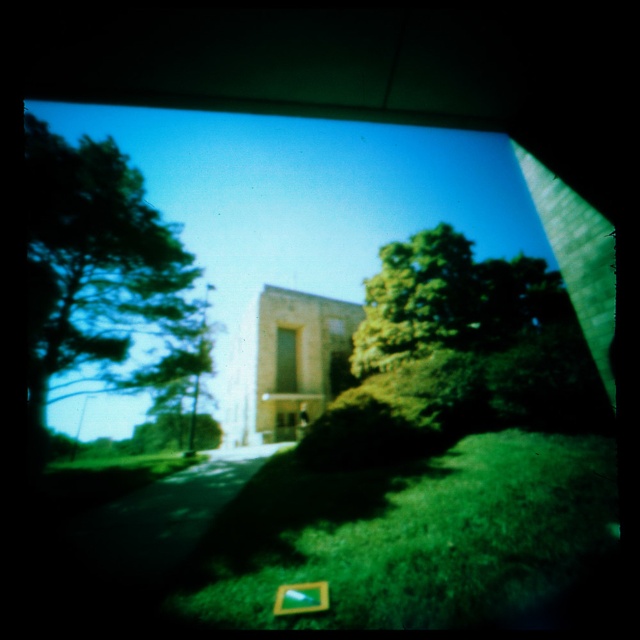
You are standing in front of the building and want to walk towards the green leafy tree at center. Which direction should you move to get closer to it while avoiding the green leafy tree at left?

Since the green leafy tree at left is closer to you than the green leafy tree at center, you should move to the right side to avoid the closer tree and head towards the tree at center.

You are standing in front of the building with the arched doorway and notice the green grass at lower center. Based on its position, can you determine if it is closer to you or farther away compared to the building?

The green grass at lower center is located at point 0.838 on the x and 0.641 on the y axis, which is closer to the viewer than the building in the background. Therefore, the green grass at lower center is closer to you compared to the building.